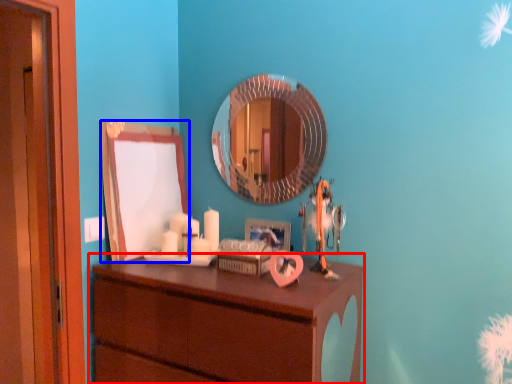
Question: Which object is further to the camera taking this photo, chest of drawers (highlighted by a red box) or mirror (highlighted by a blue box)?

Choices:
 (A) chest of drawers
 (B) mirror

Answer: (B)